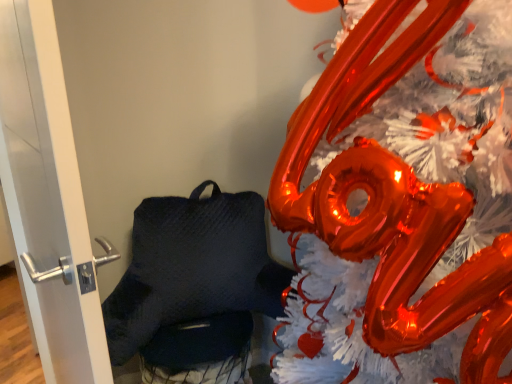
Describe the element at coordinates (48, 198) in the screenshot. This screenshot has width=512, height=384. I see `white glossy door handle at left` at that location.

The height and width of the screenshot is (384, 512). Find the location of `white glossy door handle at left`. white glossy door handle at left is located at coordinates (48, 198).

This screenshot has width=512, height=384. Identify the location of shiny metallic balloon at upper right. (402, 203).

What do you see at coordinates (402, 203) in the screenshot?
I see `shiny metallic balloon at upper right` at bounding box center [402, 203].

Identify the location of white glossy door handle at left. (48, 198).

Considering the relative positions of shiny metallic balloon at upper right and white glossy door handle at left in the image provided, is shiny metallic balloon at upper right to the left of white glossy door handle at left from the viewer's perspective?

Incorrect, shiny metallic balloon at upper right is not on the left side of white glossy door handle at left.

Which object is closer to the camera, shiny metallic balloon at upper right or white glossy door handle at left?

shiny metallic balloon at upper right is more forward.

Between point (405, 15) and point (61, 354), which one is positioned behind?

The point (61, 354) is behind.

From the picture: From the image's perspective, between shiny metallic balloon at upper right and white glossy door handle at left, who is located below?

shiny metallic balloon at upper right appears lower in the image.

From a real-world perspective, is shiny metallic balloon at upper right positioned over white glossy door handle at left based on gravity?

Actually, shiny metallic balloon at upper right is physically below white glossy door handle at left in the real world.

Can you confirm if shiny metallic balloon at upper right is wider than white glossy door handle at left?

Yes, shiny metallic balloon at upper right is wider than white glossy door handle at left.

Can you confirm if shiny metallic balloon at upper right is shorter than white glossy door handle at left?

No.

Considering the relative sizes of shiny metallic balloon at upper right and white glossy door handle at left in the image provided, is shiny metallic balloon at upper right bigger than white glossy door handle at left?

Yes.

From the picture: Is shiny metallic balloon at upper right not inside white glossy door handle at left?

Yes, shiny metallic balloon at upper right is outside of white glossy door handle at left.

Is shiny metallic balloon at upper right next to white glossy door handle at left and touching it?

shiny metallic balloon at upper right and white glossy door handle at left are not in contact.

Does shiny metallic balloon at upper right turn towards white glossy door handle at left?

No, shiny metallic balloon at upper right does not turn towards white glossy door handle at left.

Can you tell me how much shiny metallic balloon at upper right and white glossy door handle at left differ in facing direction?

The facing directions of shiny metallic balloon at upper right and white glossy door handle at left are 26.1 degrees apart.

Measure the distance from shiny metallic balloon at upper right to white glossy door handle at left.

56.36 centimeters.

I want to click on door behind the shiny metallic balloon at upper right, so click(48, 198).

Which object is positioned more to the left, white glossy door handle at left or shiny metallic balloon at upper right?

From the viewer's perspective, white glossy door handle at left appears more on the left side.

Is the depth of white glossy door handle at left less than that of shiny metallic balloon at upper right?

No, it is behind shiny metallic balloon at upper right.

Is point (40, 347) positioned in front of point (293, 137)?

No, (40, 347) is further to viewer.

From the image's perspective, does white glossy door handle at left appear lower than shiny metallic balloon at upper right?

No, from the image's perspective, white glossy door handle at left is not below shiny metallic balloon at upper right.

From a real-world perspective, which is physically above, white glossy door handle at left or shiny metallic balloon at upper right?

white glossy door handle at left.

Which of these two, white glossy door handle at left or shiny metallic balloon at upper right, is wider?

shiny metallic balloon at upper right is wider.

Between white glossy door handle at left and shiny metallic balloon at upper right, which one has more height?

shiny metallic balloon at upper right is taller.

Can you confirm if white glossy door handle at left is bigger than shiny metallic balloon at upper right?

Actually, white glossy door handle at left might be smaller than shiny metallic balloon at upper right.

Is white glossy door handle at left not inside shiny metallic balloon at upper right?

Yes.

Is white glossy door handle at left not close to shiny metallic balloon at upper right?

That's not correct — white glossy door handle at left is a little close to shiny metallic balloon at upper right.

Is shiny metallic balloon at upper right at the back of white glossy door handle at left?

No, shiny metallic balloon at upper right is not at the back of white glossy door handle at left.

How different are the orientations of white glossy door handle at left and shiny metallic balloon at upper right in degrees?

There is a 26.1-degree angle between the facing directions of white glossy door handle at left and shiny metallic balloon at upper right.

You are a GUI agent. You are given a task and a screenshot of the screen. Output one action in this format:
    pyautogui.click(x=<x>, y=<y>)
    Task: Click on the door above the shiny metallic balloon at upper right (from the image's perspective)
    This screenshot has height=384, width=512.
    Given the screenshot: What is the action you would take?
    pyautogui.click(x=48, y=198)

This screenshot has width=512, height=384. What are the coordinates of `christmas decoration beneath the white glossy door handle at left (from a real-world perspective)` in the screenshot? It's located at (402, 203).

Locate an element on the screen. This screenshot has height=384, width=512. door located above the shiny metallic balloon at upper right (from the image's perspective) is located at coordinates (48, 198).